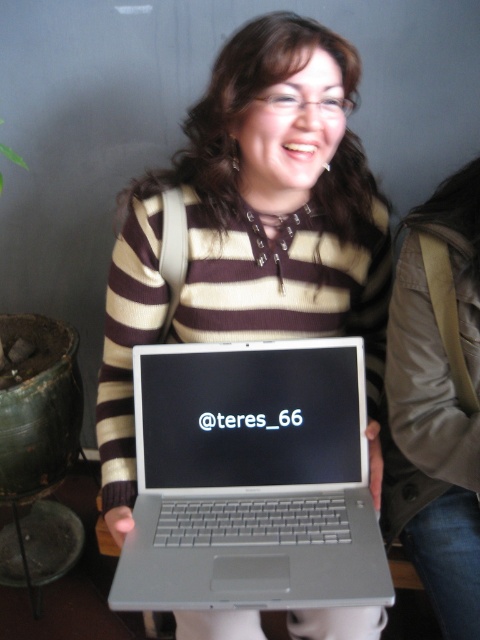
Is matte silver laptop at center thinner than silver metallic laptop at center?

In fact, matte silver laptop at center might be wider than silver metallic laptop at center.

You are a GUI agent. You are given a task and a screenshot of the screen. Output one action in this format:
    pyautogui.click(x=<x>, y=<y>)
    Task: Click on the matte silver laptop at center
    The image size is (480, 640).
    Given the screenshot: What is the action you would take?
    pyautogui.click(x=252, y=227)